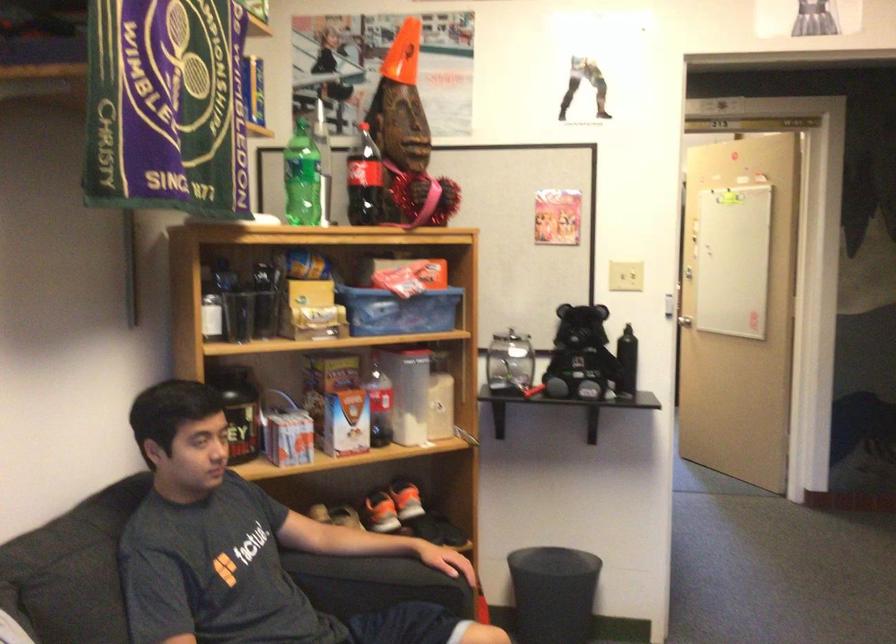
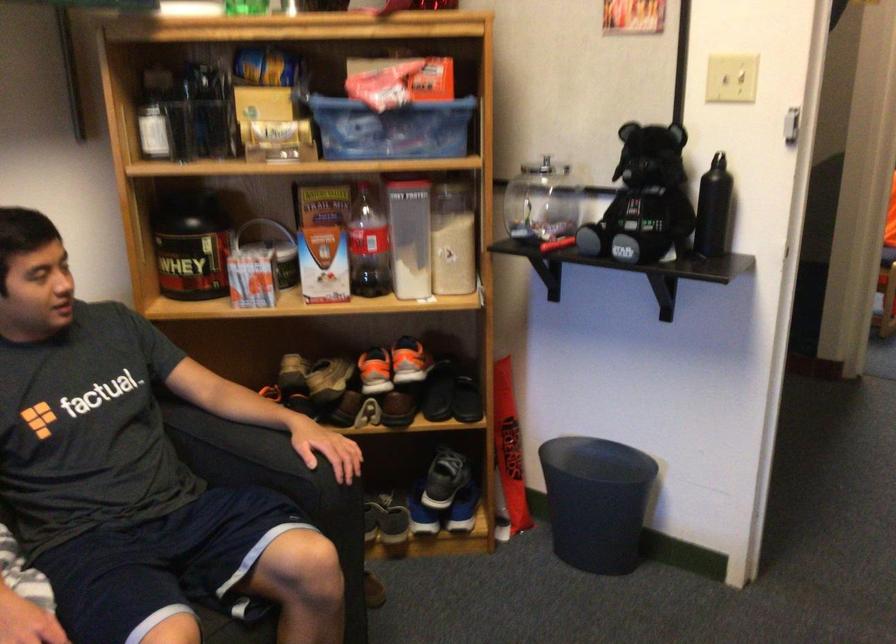
Where in the second image is the point corresponding to point (383, 404) from the first image?

(367, 245)